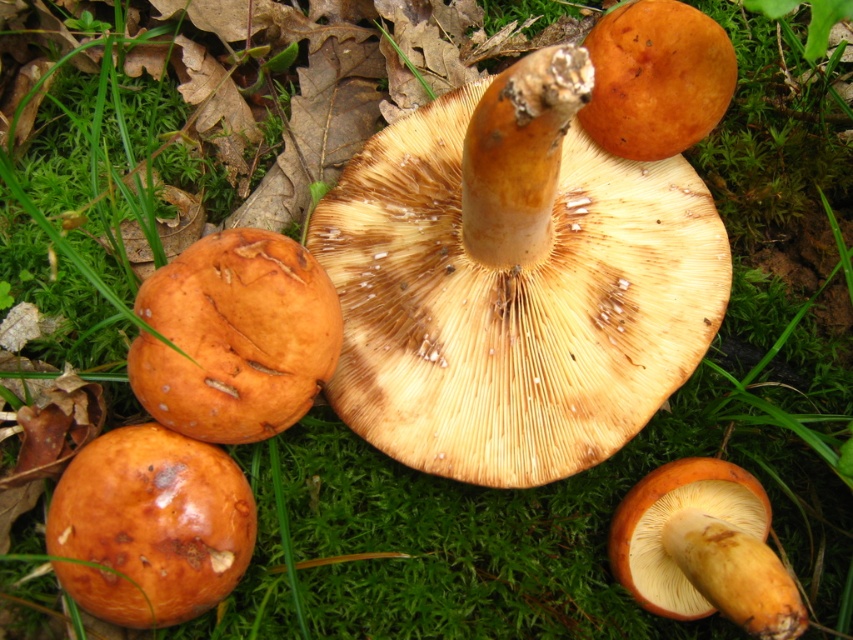
Does point (527, 100) lie in front of point (318, 385)?

Yes.

Is matte brown mushroom at center bigger than matte orange mushroom at center?

Yes.

The image size is (853, 640). Find the location of `matte brown mushroom at center`. matte brown mushroom at center is located at coordinates (514, 280).

Between shiny brown mushroom at center and shiny orange cap at center, which one has more height?

shiny brown mushroom at center is taller.

Which is behind, point (767, 618) or point (653, 109)?

Point (653, 109)

At what (x,y) coordinates should I click in order to perform the action: click on shiny brown mushroom at center. Please return your answer as a coordinate pair (x, y). Looking at the image, I should click on (703, 548).

Can you confirm if matte orange mushroom at center is positioned above shiny brown mushroom at center?

Yes, matte orange mushroom at center is above shiny brown mushroom at center.

Does matte orange mushroom at center appear on the left side of shiny brown mushroom at center?

Correct, you'll find matte orange mushroom at center to the left of shiny brown mushroom at center.

Which is in front, point (219, 362) or point (755, 592)?

Point (755, 592) is in front.

In order to click on matte orange mushroom at center in this screenshot , I will do `click(235, 337)`.